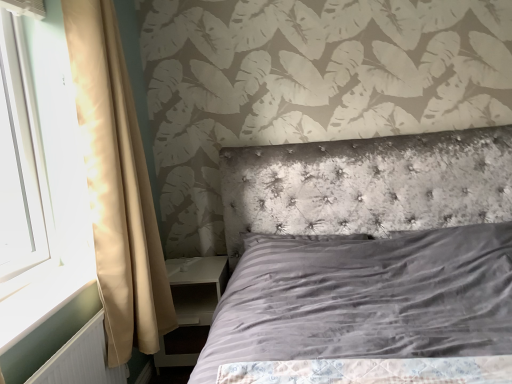
Question: Is white glossy nightstand at lower left taller than white plastic radiator at lower left?

Choices:
 (A) no
 (B) yes

Answer: (B)

Question: Is white glossy nightstand at lower left facing towards white plastic radiator at lower left?

Choices:
 (A) yes
 (B) no

Answer: (A)

Question: Is white glossy nightstand at lower left completely or partially outside of white plastic radiator at lower left?

Choices:
 (A) no
 (B) yes

Answer: (B)

Question: Does white glossy nightstand at lower left have a lesser width compared to white plastic radiator at lower left?

Choices:
 (A) yes
 (B) no

Answer: (B)

Question: From a real-world perspective, is white glossy nightstand at lower left physically above white plastic radiator at lower left?

Choices:
 (A) yes
 (B) no

Answer: (B)

Question: Does white glossy nightstand at lower left appear on the right side of white plastic radiator at lower left?

Choices:
 (A) yes
 (B) no

Answer: (A)

Question: Does white glossy wood at left appear on the right side of white plastic radiator at lower left?

Choices:
 (A) no
 (B) yes

Answer: (A)

Question: Is white glossy wood at left completely or partially outside of white plastic radiator at lower left?

Choices:
 (A) no
 (B) yes

Answer: (B)

Question: Would you consider white glossy wood at left to be distant from white plastic radiator at lower left?

Choices:
 (A) no
 (B) yes

Answer: (A)

Question: Does white glossy wood at left have a larger size compared to white plastic radiator at lower left?

Choices:
 (A) yes
 (B) no

Answer: (B)

Question: Does white glossy wood at left have a greater height compared to white plastic radiator at lower left?

Choices:
 (A) yes
 (B) no

Answer: (B)

Question: From the image's perspective, is white glossy wood at left located beneath white plastic radiator at lower left?

Choices:
 (A) yes
 (B) no

Answer: (B)

Question: Would you say beige satin curtain at left is a long distance from white plastic radiator at lower left?

Choices:
 (A) yes
 (B) no

Answer: (B)